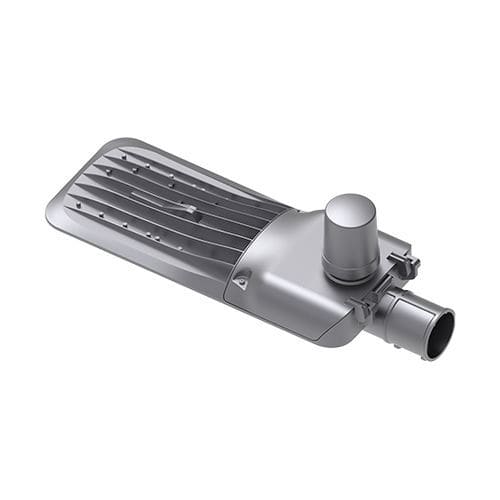
Locate an element on the screen. space to right of mirror is located at coordinates (457, 291).